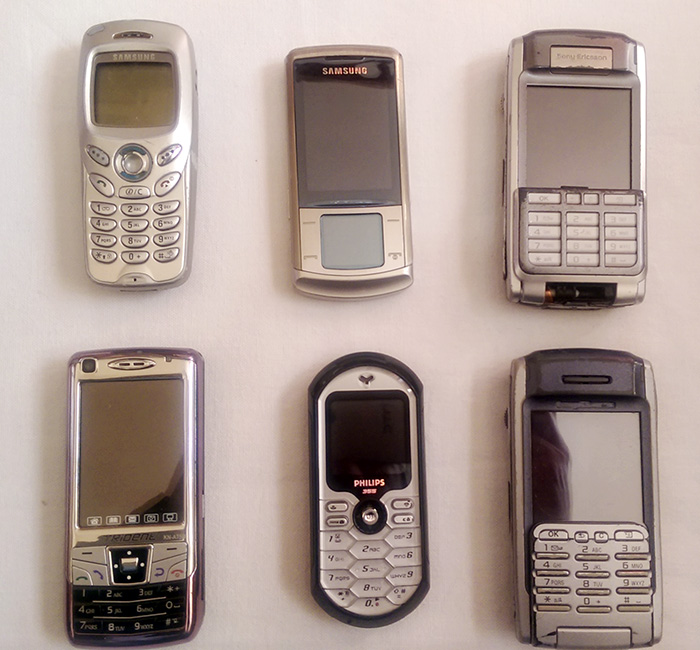
Locate an element on the screen. phones is located at coordinates (574, 504), (368, 528), (154, 552), (573, 228), (344, 247), (139, 234).